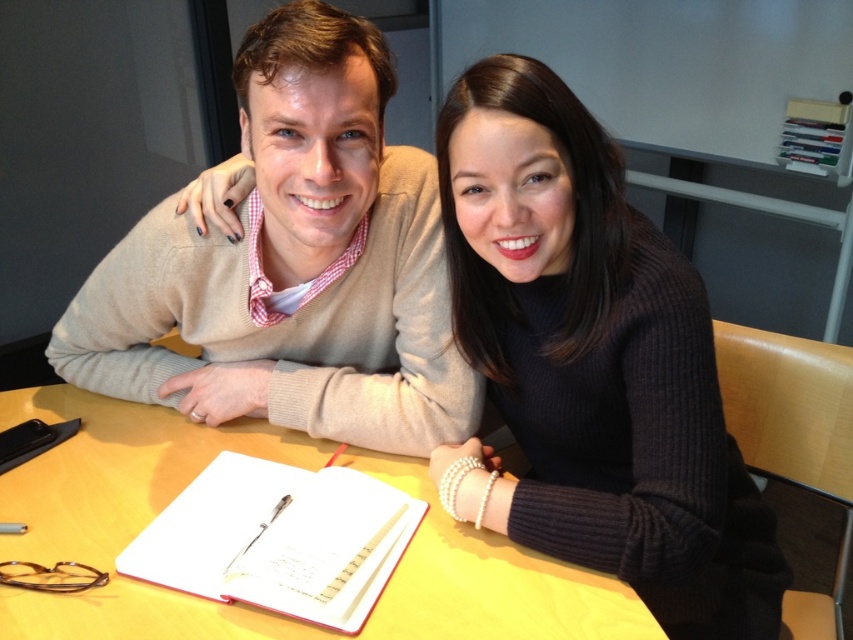
Question: Is the position of black ribbed sweater at center more distant than that of red matte notebook at center?

Choices:
 (A) no
 (B) yes

Answer: (B)

Question: Which point is closer to the camera taking this photo?

Choices:
 (A) (486, 323)
 (B) (181, 378)

Answer: (A)

Question: Is black ribbed sweater at center to the right of yellow matte table at center from the viewer's perspective?

Choices:
 (A) yes
 (B) no

Answer: (A)

Question: Estimate the real-world distances between objects in this image. Which object is closer to the yellow matte table at center?

Choices:
 (A) red matte notebook at center
 (B) beige sweater at upper left

Answer: (A)

Question: Which object is positioned farthest from the beige sweater at upper left?

Choices:
 (A) yellow matte table at center
 (B) black ribbed sweater at center
 (C) red matte notebook at center

Answer: (C)

Question: Can you confirm if black ribbed sweater at center is positioned below red matte notebook at center?

Choices:
 (A) no
 (B) yes

Answer: (A)